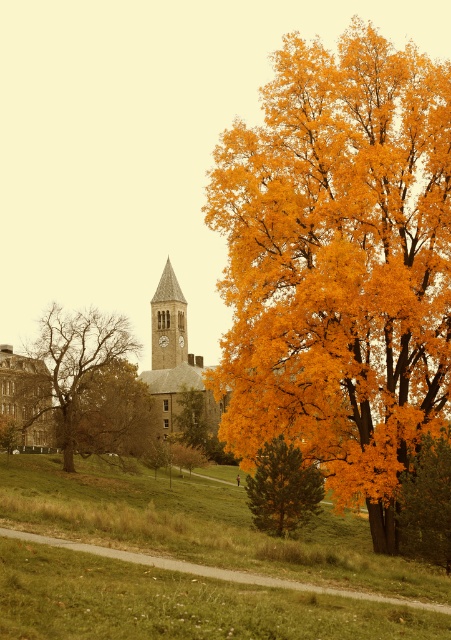
Does point (298, 516) lie behind point (170, 352)?

No, it is not.

Which is above, green matte tree at center or smooth stone clock tower at center?

smooth stone clock tower at center

Between point (266, 484) and point (151, 342), which one is positioned behind?

The point (151, 342) is behind.

Locate an element on the screen. Image resolution: width=451 pixels, height=640 pixels. green matte tree at center is located at coordinates (282, 488).

Does green grassy at lower left have a smaller size compared to brown textured tree at lower left?

No.

Between point (280, 596) and point (13, 429), which one is positioned in front?

Point (280, 596) is in front.

Looking at this image, who is more forward, (326,608) or (13,436)?

Point (326,608)

This screenshot has height=640, width=451. What are the coordinates of `green grassy at lower left` in the screenshot? It's located at (198, 525).

Is green grassy at lower left shorter than golden textured tree at center?

No, green grassy at lower left is not shorter than golden textured tree at center.

Where is `green grassy at lower left`? green grassy at lower left is located at coordinates (198, 525).

Locate an element on the screen. green grassy at lower left is located at coordinates click(x=198, y=525).